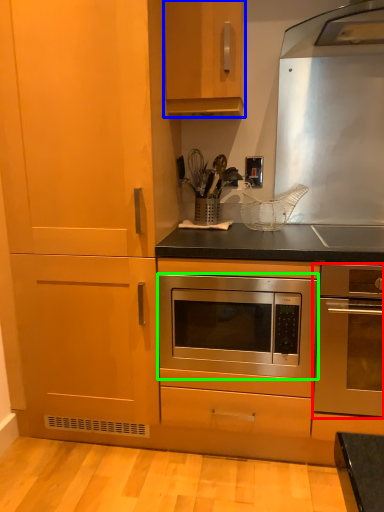
Question: Based on their relative distances, which object is nearer to oven (highlighted by a red box)? Choose from cabinetry (highlighted by a blue box) and oven (highlighted by a green box).

Choices:
 (A) cabinetry
 (B) oven

Answer: (B)